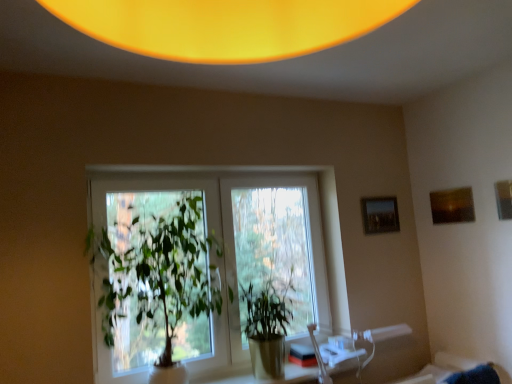
Locate an element on the screen. clear glass window at center is located at coordinates (237, 233).

Find the location of `wooden picture frame at upper right, marked as the 1th picture frame in a right-to-left arrangement`. wooden picture frame at upper right, marked as the 1th picture frame in a right-to-left arrangement is located at coordinates (504, 199).

The height and width of the screenshot is (384, 512). What are the coordinates of `green leafy plant at center, the first houseplant from the left` in the screenshot? It's located at (158, 284).

Which object is positioned more to the right, translucent glass table at center or matte black picture frame at upper right, the 1th picture frame when ordered from left to right?

matte black picture frame at upper right, the 1th picture frame when ordered from left to right.

Where is `table directly beneath the matte black picture frame at upper right, the 1th picture frame when ordered from left to right (from a real-world perspective)`? This screenshot has width=512, height=384. table directly beneath the matte black picture frame at upper right, the 1th picture frame when ordered from left to right (from a real-world perspective) is located at coordinates (269, 380).

Is translucent glass table at center aimed at matte black picture frame at upper right, the 1th picture frame when ordered from left to right?

No, translucent glass table at center is not facing towards matte black picture frame at upper right, the 1th picture frame when ordered from left to right.

Based on the photo, from a real-world perspective, between translucent glass table at center and matte black picture frame at upper right, the third picture frame from the front, who is vertically higher?

In real-world perspective, matte black picture frame at upper right, the third picture frame from the front, is above.

Looking at this image, who is bigger, matte brown picture frame at upper right, which ranks as the second picture frame in back-to-front order, or green leafy plant at center, which is the 2th houseplant from right to left?

green leafy plant at center, which is the 2th houseplant from right to left, is bigger.

Is matte brown picture frame at upper right, placed as the 2th picture frame when sorted from front to back, facing towards green leafy plant at center, which is the 2th houseplant from right to left?

Yes, matte brown picture frame at upper right, placed as the 2th picture frame when sorted from front to back, is facing green leafy plant at center, which is the 2th houseplant from right to left.

Would you say matte brown picture frame at upper right, which ranks as the second picture frame in back-to-front order, contains green leafy plant at center, which is the 2th houseplant from right to left?

That's incorrect, green leafy plant at center, which is the 2th houseplant from right to left, is not inside matte brown picture frame at upper right, which ranks as the second picture frame in back-to-front order.

Locate an element on the screen. The height and width of the screenshot is (384, 512). picture frame that is the 2nd object located behind the green leafy plant at center, the first houseplant from the left is located at coordinates (452, 206).

Would you say clear glass window at center is inside or outside matte brown picture frame at upper right, placed as the 2th picture frame when sorted from front to back?

clear glass window at center cannot be found inside matte brown picture frame at upper right, placed as the 2th picture frame when sorted from front to back.

From a real-world perspective, does clear glass window at center stand above matte brown picture frame at upper right, which ranks as the second picture frame in back-to-front order?

No, from a real-world perspective, clear glass window at center is not over matte brown picture frame at upper right, which ranks as the second picture frame in back-to-front order

The height and width of the screenshot is (384, 512). I want to click on window in front of the matte brown picture frame at upper right, which ranks as the second picture frame in back-to-front order, so click(x=237, y=233).

Does clear glass window at center have a greater height compared to matte brown picture frame at upper right, placed as the 2th picture frame when sorted from front to back?

Yes, clear glass window at center is taller than matte brown picture frame at upper right, placed as the 2th picture frame when sorted from front to back.

Can you confirm if green glossy plant at center, acting as the 2th houseplant starting from the left, is shorter than matte brown picture frame at upper right, which is the 2th picture frame in right-to-left order?

No, green glossy plant at center, acting as the 2th houseplant starting from the left, is not shorter than matte brown picture frame at upper right, which is the 2th picture frame in right-to-left order.

Is green glossy plant at center, acting as the 2th houseplant starting from the left, looking in the opposite direction of matte brown picture frame at upper right, which is the 2th picture frame from left to right?

green glossy plant at center, acting as the 2th houseplant starting from the left, does not have its back to matte brown picture frame at upper right, which is the 2th picture frame from left to right.

Between green glossy plant at center, the 1th houseplant from the right, and matte brown picture frame at upper right, which is the 2th picture frame from left to right, which one has larger width?

green glossy plant at center, the 1th houseplant from the right.

Does green glossy plant at center, acting as the 2th houseplant starting from the left, lie behind matte brown picture frame at upper right, which is the 2th picture frame in right-to-left order?

That is False.

Which of these two, matte black picture frame at upper right, the third picture frame from the front, or translucent glass table at center, is bigger?

With larger size is translucent glass table at center.

Could you tell me if matte black picture frame at upper right, which is the first picture frame in back-to-front order, is facing translucent glass table at center?

No, matte black picture frame at upper right, which is the first picture frame in back-to-front order, is not turned towards translucent glass table at center.

Would you say matte black picture frame at upper right, the third picture frame from the front, is inside or outside translucent glass table at center?

matte black picture frame at upper right, the third picture frame from the front, is located beyond the bounds of translucent glass table at center.

From a real-world perspective, is matte black picture frame at upper right, which is the first picture frame in back-to-front order, above or below translucent glass table at center?

From a real-world perspective, matte black picture frame at upper right, which is the first picture frame in back-to-front order, is physically above translucent glass table at center.

Which object is positioned more to the right, matte brown picture frame at upper right, which ranks as the second picture frame in back-to-front order, or matte black picture frame at upper right, the 1th picture frame when ordered from left to right?

Positioned to the right is matte brown picture frame at upper right, which ranks as the second picture frame in back-to-front order.

From the image's perspective, would you say matte brown picture frame at upper right, which ranks as the second picture frame in back-to-front order, is shown under matte black picture frame at upper right, which is the first picture frame in back-to-front order?

No.

Considering the points (471, 200) and (387, 210), which point is in front, point (471, 200) or point (387, 210)?

The point (471, 200) is closer.

Considering the sizes of objects matte brown picture frame at upper right, placed as the 2th picture frame when sorted from front to back, and matte black picture frame at upper right, the third picture frame from the front, in the image provided, who is thinner, matte brown picture frame at upper right, placed as the 2th picture frame when sorted from front to back, or matte black picture frame at upper right, the third picture frame from the front,?

matte brown picture frame at upper right, placed as the 2th picture frame when sorted from front to back, is thinner.

Does green glossy plant at center, the 1th houseplant from the right, have a greater height compared to wooden picture frame at upper right, the 1th picture frame in the front-to-back sequence?

Indeed, green glossy plant at center, the 1th houseplant from the right, has a greater height compared to wooden picture frame at upper right, the 1th picture frame in the front-to-back sequence.

From a real-world perspective, is green glossy plant at center, the 1th houseplant from the right, positioned over wooden picture frame at upper right, placed as the 3th picture frame when sorted from back to front, based on gravity?

No, from a real-world perspective, green glossy plant at center, the 1th houseplant from the right, is not on top of wooden picture frame at upper right, placed as the 3th picture frame when sorted from back to front.

The width and height of the screenshot is (512, 384). I want to click on houseplant that is the 1st one when counting leftward from the wooden picture frame at upper right, placed as the 3th picture frame when sorted from back to front, so click(267, 327).

In the scene shown: Is green glossy plant at center, acting as the 2th houseplant starting from the left, not within wooden picture frame at upper right, the 1th picture frame in the front-to-back sequence?

green glossy plant at center, acting as the 2th houseplant starting from the left, is positioned outside wooden picture frame at upper right, the 1th picture frame in the front-to-back sequence.

Locate an element on the screen. The height and width of the screenshot is (384, 512). table in front of the matte black picture frame at upper right, the third picture frame from the front is located at coordinates (269, 380).

Where is `the 2nd picture frame positioned above the green leafy plant at center, which is the 2th houseplant from right to left (from a real-world perspective)`? This screenshot has width=512, height=384. the 2nd picture frame positioned above the green leafy plant at center, which is the 2th houseplant from right to left (from a real-world perspective) is located at coordinates (452, 206).

Looking at the image, which one is located closer to matte brown picture frame at upper right, which ranks as the second picture frame in back-to-front order, wooden picture frame at upper right, the 1th picture frame in the front-to-back sequence, or matte black picture frame at upper right, the third picture frame from the front?

wooden picture frame at upper right, the 1th picture frame in the front-to-back sequence, is positioned closer to the anchor matte brown picture frame at upper right, which ranks as the second picture frame in back-to-front order.

In the scene shown: Which object lies further to the anchor point green leafy plant at center, the first houseplant from the left, green glossy plant at center, the 1th houseplant from the right, or clear glass window at center?

green glossy plant at center, the 1th houseplant from the right, is positioned further to the anchor green leafy plant at center, the first houseplant from the left.

Looking at the image, which one is located further to green leafy plant at center, which is the 2th houseplant from right to left, matte black picture frame at upper right, the 1th picture frame when ordered from left to right, or clear glass window at center?

matte black picture frame at upper right, the 1th picture frame when ordered from left to right.

When comparing their distances from wooden picture frame at upper right, placed as the 3th picture frame when sorted from back to front, does matte brown picture frame at upper right, which ranks as the second picture frame in back-to-front order, or clear glass window at center seem further?

clear glass window at center.

Which object lies further to the anchor point wooden picture frame at upper right, marked as the 1th picture frame in a right-to-left arrangement, green glossy plant at center, acting as the 2th houseplant starting from the left, or green leafy plant at center, the first houseplant from the left?

green leafy plant at center, the first houseplant from the left, lies further to wooden picture frame at upper right, marked as the 1th picture frame in a right-to-left arrangement, than the other object.

Which object lies nearer to the anchor point translucent glass table at center, wooden picture frame at upper right, the third picture frame in the left-to-right sequence, or green glossy plant at center, the 1th houseplant from the right?

Based on the image, green glossy plant at center, the 1th houseplant from the right, appears to be nearer to translucent glass table at center.

From the image, which object appears to be nearer to translucent glass table at center, clear glass window at center or green glossy plant at center, acting as the 2th houseplant starting from the left?

green glossy plant at center, acting as the 2th houseplant starting from the left, lies closer to translucent glass table at center than the other object.

When comparing their distances from matte brown picture frame at upper right, which is the 2th picture frame from left to right, does translucent glass table at center or green glossy plant at center, the 1th houseplant from the right, seem further?

green glossy plant at center, the 1th houseplant from the right, is positioned further to the anchor matte brown picture frame at upper right, which is the 2th picture frame from left to right.

I want to click on table between green leafy plant at center, the first houseplant from the left, and matte brown picture frame at upper right, placed as the 2th picture frame when sorted from front to back, from left to right, so click(x=269, y=380).

Identify the location of table situated between green leafy plant at center, which is the 2th houseplant from right to left, and wooden picture frame at upper right, placed as the 3th picture frame when sorted from back to front, from left to right. (269, 380).

Locate an element on the screen. The image size is (512, 384). picture frame between clear glass window at center and matte brown picture frame at upper right, which is the 2th picture frame in right-to-left order, in the horizontal direction is located at coordinates (380, 215).

Locate an element on the screen. table between clear glass window at center and matte black picture frame at upper right, the 1th picture frame when ordered from left to right, in the horizontal direction is located at coordinates (269, 380).